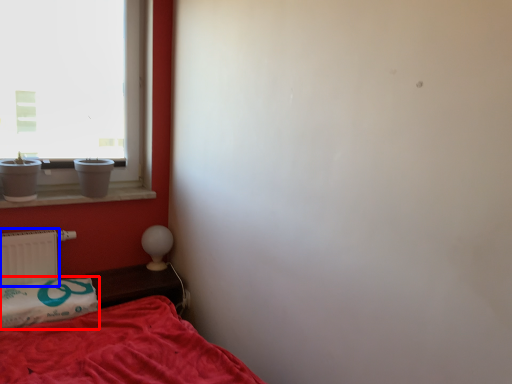
Question: Which of the following is the closest to the observer, pillow (highlighted by a red box) or radiator (highlighted by a blue box)?

Choices:
 (A) pillow
 (B) radiator

Answer: (A)